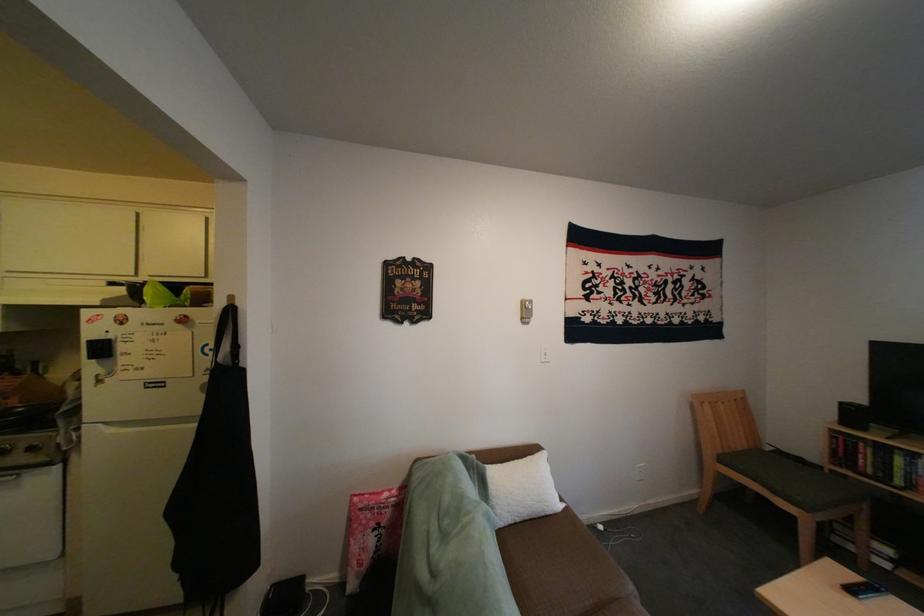
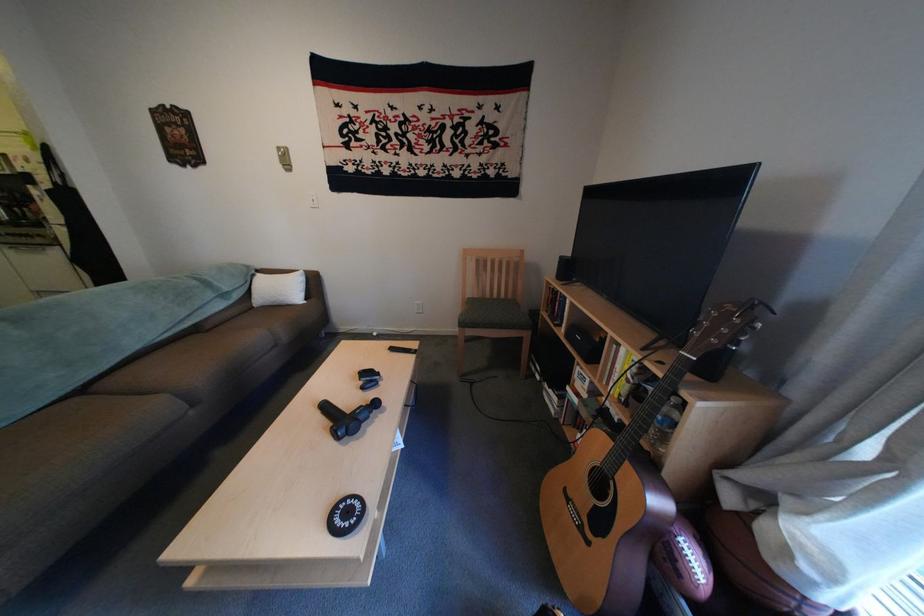
Question: The images are taken continuously from a first-person perspective. In which direction are you moving?

Choices:
 (A) Left
 (B) Right
 (C) Forward
 (D) Backward

Answer: (B)